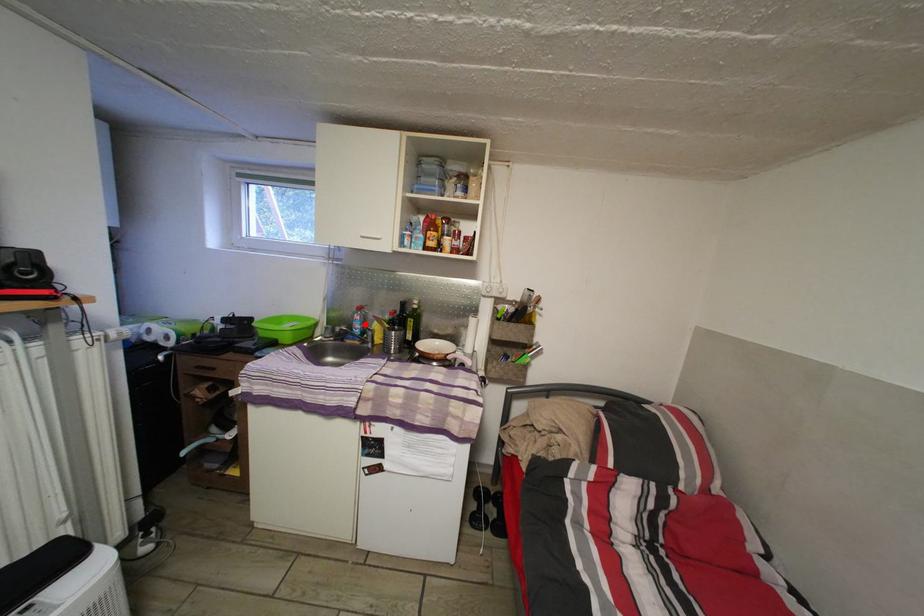
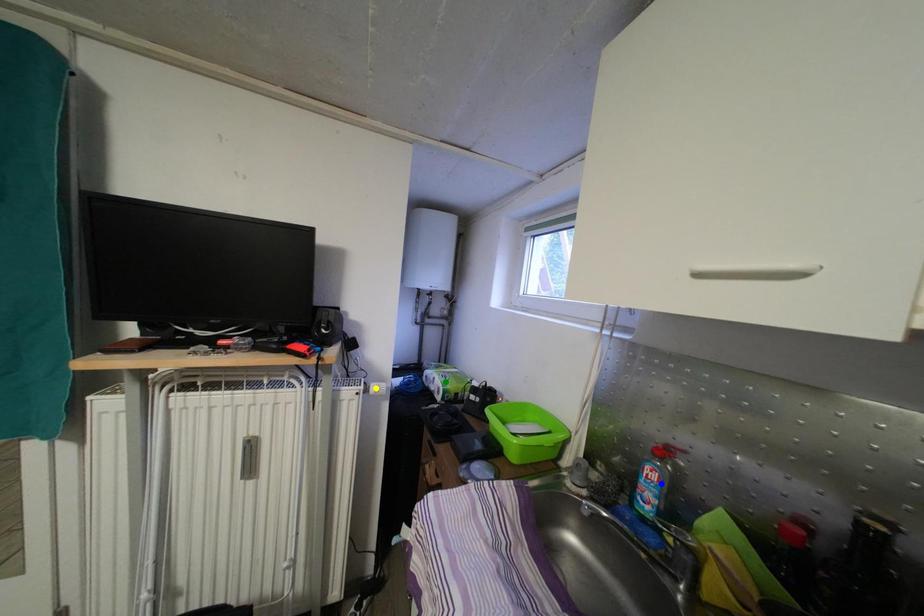
Question: I am providing you with two images of the same scene from different viewpoints. A red point is marked on the first image. You are given multiple points on the second image. Can you choose the point in image 2 that corresponds to the point in image 1?

Choices:
 (A) green point
 (B) blue point
 (C) yellow point

Answer: (B)